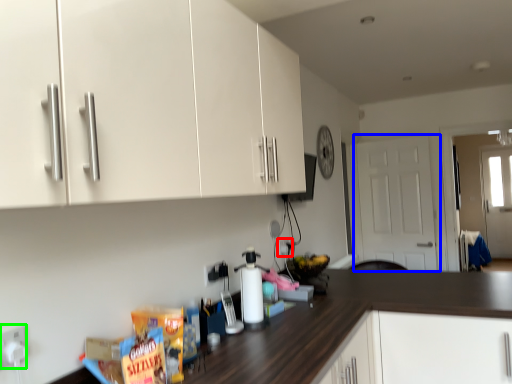
Question: Considering the real-world distances, which object is closest to electric outlet (highlighted by a red box)? door (highlighted by a blue box) or electric outlet (highlighted by a green box).

Choices:
 (A) door
 (B) electric outlet

Answer: (B)